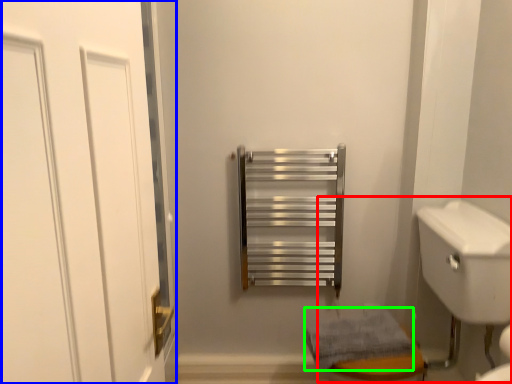
Question: Estimate the real-world distances between objects in this image. Which object is closer to sink (highlighted by a red box), door (highlighted by a blue box) or bath towel (highlighted by a green box)?

Choices:
 (A) door
 (B) bath towel

Answer: (B)